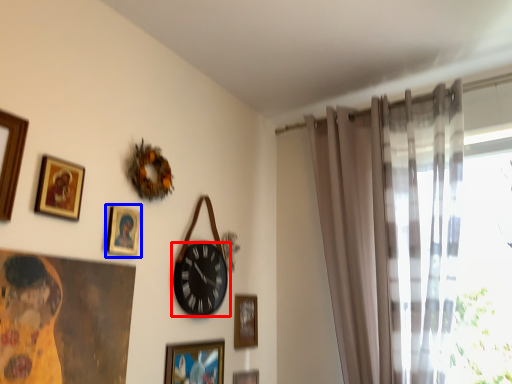
Question: Among these objects, which one is nearest to the camera, wall clock (highlighted by a red box) or picture frame (highlighted by a blue box)?

Choices:
 (A) wall clock
 (B) picture frame

Answer: (B)